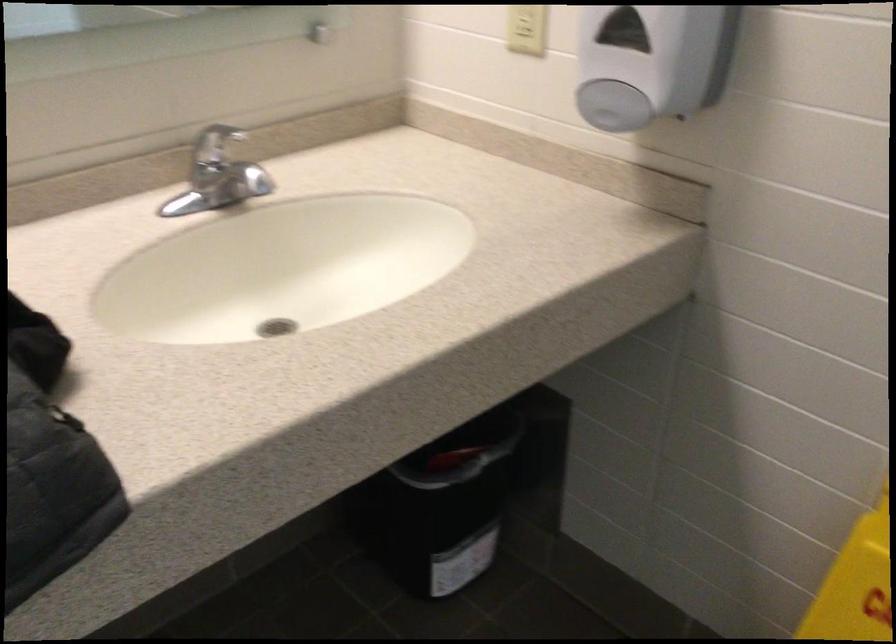
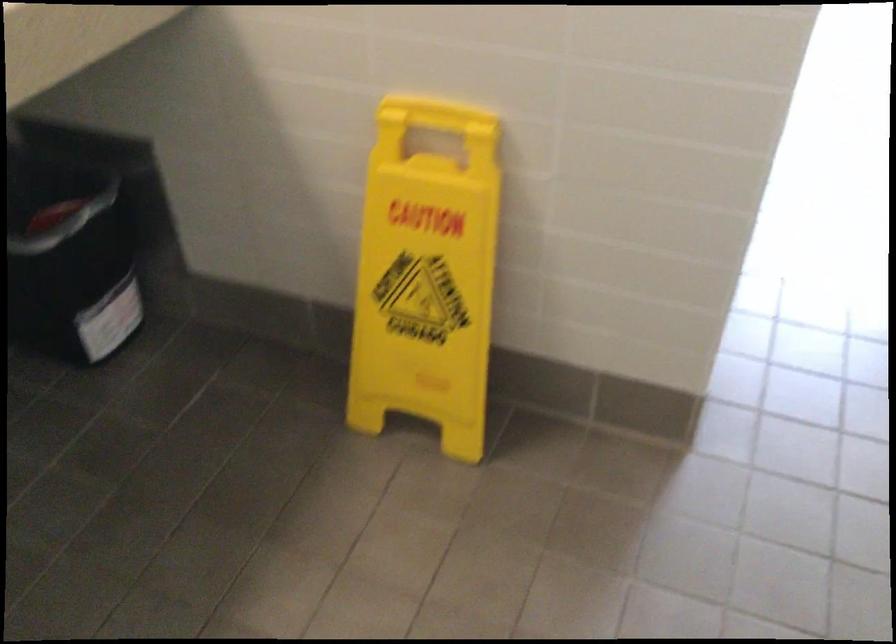
In a continuous first-person perspective shot, in which direction is the camera moving?

The movement direction of the cameraman is right, backward.